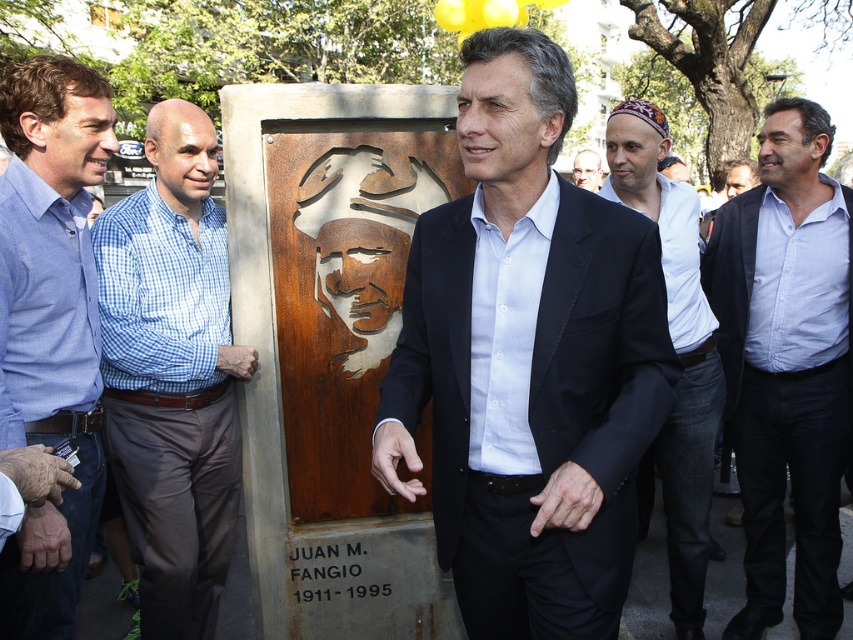
I want to click on white cotton shirt at center, so click(675, 352).

Looking at this image, does white cotton shirt at center have a lesser width compared to matte brown statue at center?

No.

Where is `white cotton shirt at center`? This screenshot has width=853, height=640. white cotton shirt at center is located at coordinates (675, 352).

Identify the location of white cotton shirt at center. The height and width of the screenshot is (640, 853). (675, 352).

Between rustic metal plaque at center and blue checkered shirt at center, which one appears on the right side from the viewer's perspective?

rustic metal plaque at center is more to the right.

Based on the photo, measure the distance between rustic metal plaque at center and camera.

A distance of 1.78 meters exists between rustic metal plaque at center and camera.

Image resolution: width=853 pixels, height=640 pixels. Describe the element at coordinates (527, 362) in the screenshot. I see `rustic metal plaque at center` at that location.

The width and height of the screenshot is (853, 640). Identify the location of rustic metal plaque at center. (527, 362).

Is blue checkered shirt at center to the right of matte brown statue at center from the viewer's perspective?

Incorrect, blue checkered shirt at center is not on the right side of matte brown statue at center.

Which is more to the left, blue checkered shirt at center or matte brown statue at center?

From the viewer's perspective, blue checkered shirt at center appears more on the left side.

Locate an element on the screen. Image resolution: width=853 pixels, height=640 pixels. blue checkered shirt at center is located at coordinates (172, 376).